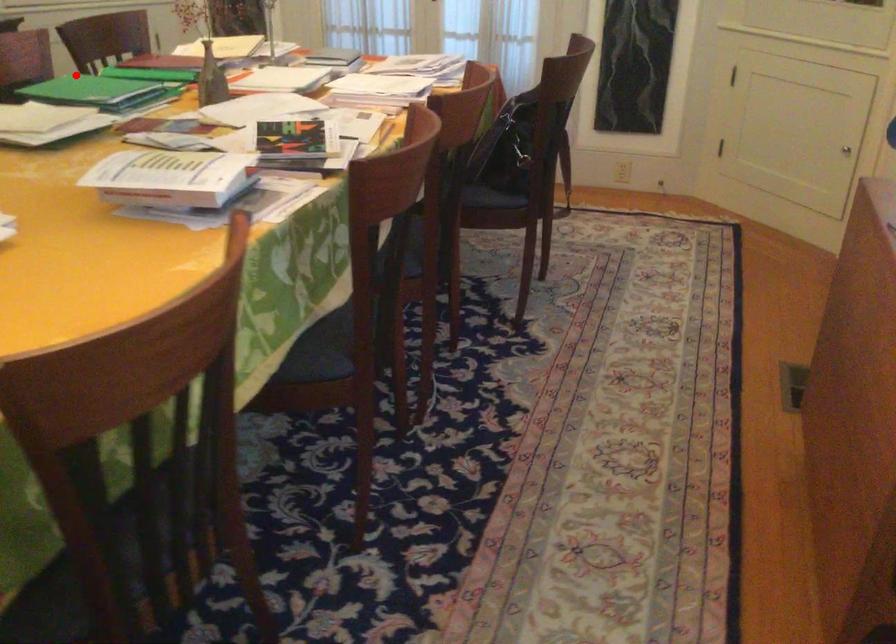
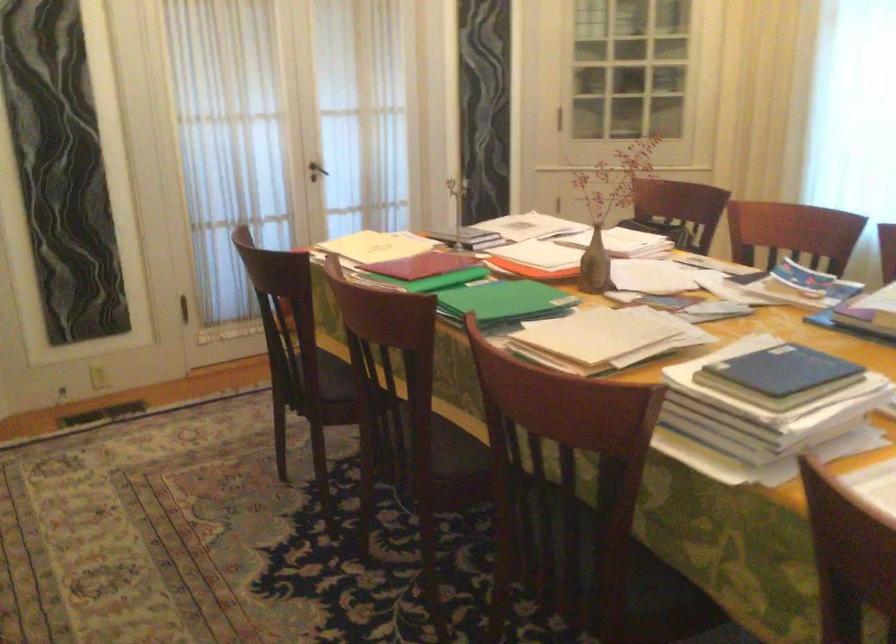
Question: I am providing you with two images of the same scene from different viewpoints. In image1, a red point is highlighted. Considering the same 3D point in image2, which of the following is correct?

Choices:
 (A) It is closer
 (B) It is farther

Answer: (A)